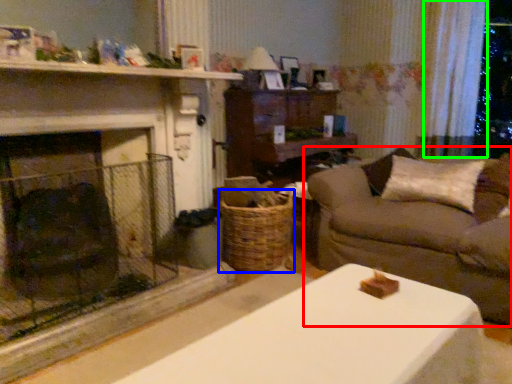
Question: Considering the real-world distances, which object is farthest from studio couch (highlighted by a red box)? basket (highlighted by a blue box) or curtain (highlighted by a green box)?

Choices:
 (A) basket
 (B) curtain

Answer: (B)